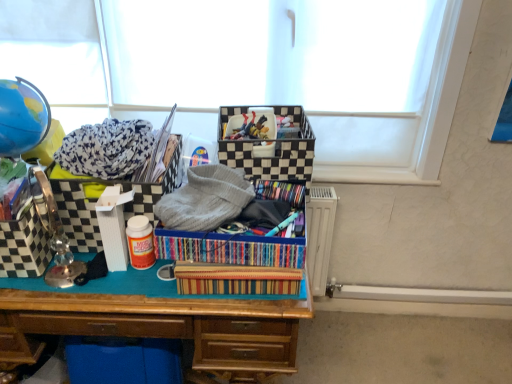
Question: Is wooden desk at center further to camera compared to checkered fabric storage box at left, which is the 2th storage box from right to left?

Choices:
 (A) no
 (B) yes

Answer: (A)

Question: Is wooden desk at center to the left of checkered fabric storage box at left, the 2th storage box positioned from the left, from the viewer's perspective?

Choices:
 (A) yes
 (B) no

Answer: (B)

Question: Is wooden desk at center thinner than checkered fabric storage box at left, which is the 2th storage box from right to left?

Choices:
 (A) no
 (B) yes

Answer: (A)

Question: From a real-world perspective, is wooden desk at center over checkered fabric storage box at left, which is the 2th storage box from right to left?

Choices:
 (A) yes
 (B) no

Answer: (B)

Question: Is wooden desk at center aimed at checkered fabric storage box at left, the 2th storage box positioned from the left?

Choices:
 (A) yes
 (B) no

Answer: (B)

Question: From the image's perspective, is black checkered storage box at center, the first storage box viewed from the right, positioned above or below checkered fabric storage box at left, the 2th storage box positioned from the left?

Choices:
 (A) below
 (B) above

Answer: (B)

Question: Is black checkered storage box at center, the third storage box in the left-to-right sequence, inside the boundaries of checkered fabric storage box at left, which is the 2th storage box from right to left, or outside?

Choices:
 (A) inside
 (B) outside

Answer: (B)

Question: In terms of size, does black checkered storage box at center, the first storage box viewed from the right, appear bigger or smaller than checkered fabric storage box at left, the 2th storage box positioned from the left?

Choices:
 (A) small
 (B) big

Answer: (A)

Question: From a real-world perspective, is black checkered storage box at center, the third storage box in the left-to-right sequence, physically located above or below checkered fabric storage box at left, which is the 2th storage box from right to left?

Choices:
 (A) above
 (B) below

Answer: (A)

Question: From the image's perspective, is black checkered storage box at center, the first storage box viewed from the right, located above or below striped fabric crate at center?

Choices:
 (A) below
 (B) above

Answer: (B)

Question: Would you say black checkered storage box at center, the first storage box viewed from the right, is inside or outside striped fabric crate at center?

Choices:
 (A) inside
 (B) outside

Answer: (B)

Question: From a real-world perspective, is black checkered storage box at center, the third storage box in the left-to-right sequence, positioned above or below striped fabric crate at center?

Choices:
 (A) above
 (B) below

Answer: (A)

Question: Is point (272, 173) positioned closer to the camera than point (163, 244)?

Choices:
 (A) farther
 (B) closer

Answer: (A)

Question: Based on their positions, is checkered fabric storage box at left, the 2th storage box positioned from the left, located to the left or right of multicolored striped fabric at center?

Choices:
 (A) right
 (B) left

Answer: (B)

Question: Looking at the image, does checkered fabric storage box at left, the 2th storage box positioned from the left, seem bigger or smaller compared to multicolored striped fabric at center?

Choices:
 (A) big
 (B) small

Answer: (A)